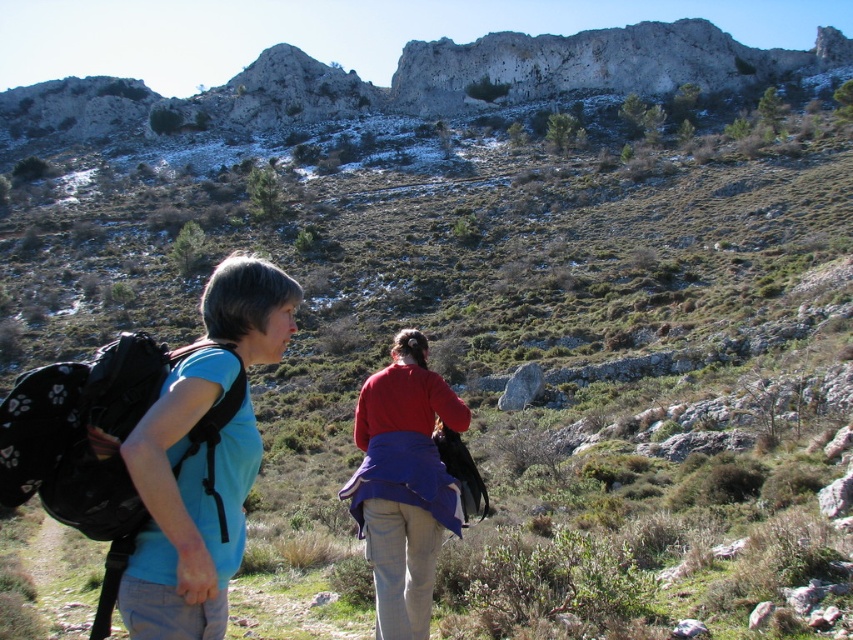
You are a hiker trying to reach a viewpoint located to the north. You have two items in your view, the black fabric backpack at left and the matte red sweater at center. Which item is closer to your current position?

The black fabric backpack at left is closer to your current position because it is positioned under the matte red sweater at center, indicating it is nearer to the observer.

In the scene shown: You are planning to carry both the blue fabric backpack at left and the matte red sweater at center while hiking. Based on their widths, which item would be easier to fit into a narrow storage compartment?

The blue fabric backpack at left has a lesser width compared to the matte red sweater at center, so it would be easier to fit into a narrow storage compartment.